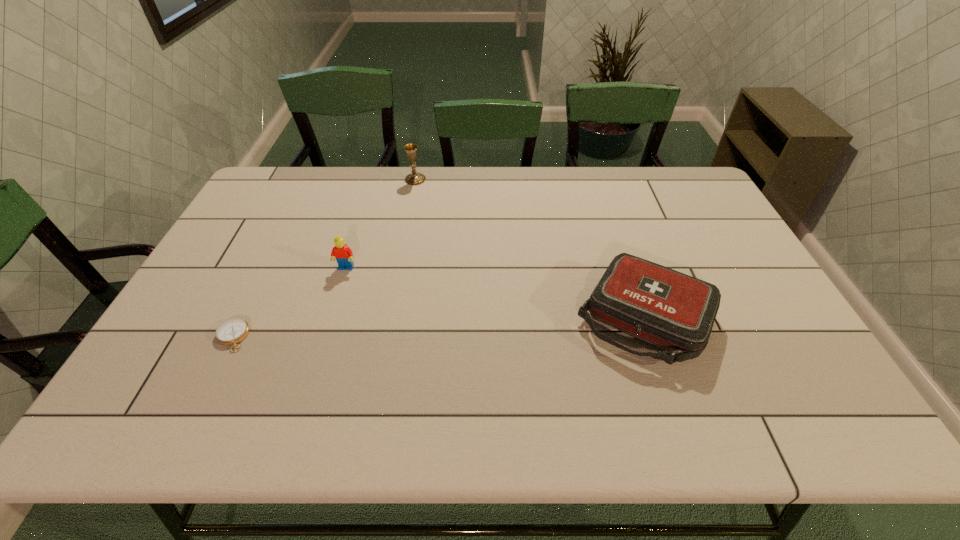
Identify the location of the farthest object. 414,178.

Where is `chalice`? This screenshot has width=960, height=540. chalice is located at coordinates (414, 178).

Where is `the third object from right to left`? The width and height of the screenshot is (960, 540). the third object from right to left is located at coordinates (343, 254).

This screenshot has width=960, height=540. Identify the location of the second farthest object. (343, 254).

In order to click on the first-aid kit in this screenshot , I will do `click(668, 309)`.

Identify the location of compass. The image size is (960, 540). (230, 332).

At what (x,y) coordinates should I click in order to perform the action: click on the leftmost object. Please return your answer as a coordinate pair (x, y). Looking at the image, I should click on pos(230,332).

Locate an element on the screen. Image resolution: width=960 pixels, height=540 pixels. free space located 0.200m on the right of the second object from right to left is located at coordinates (482, 180).

The image size is (960, 540). I want to click on vacant space located on the face of the second object from left to right, so click(306, 397).

Where is `vacant space located on the left of the rightmost object`? Image resolution: width=960 pixels, height=540 pixels. vacant space located on the left of the rightmost object is located at coordinates (520, 318).